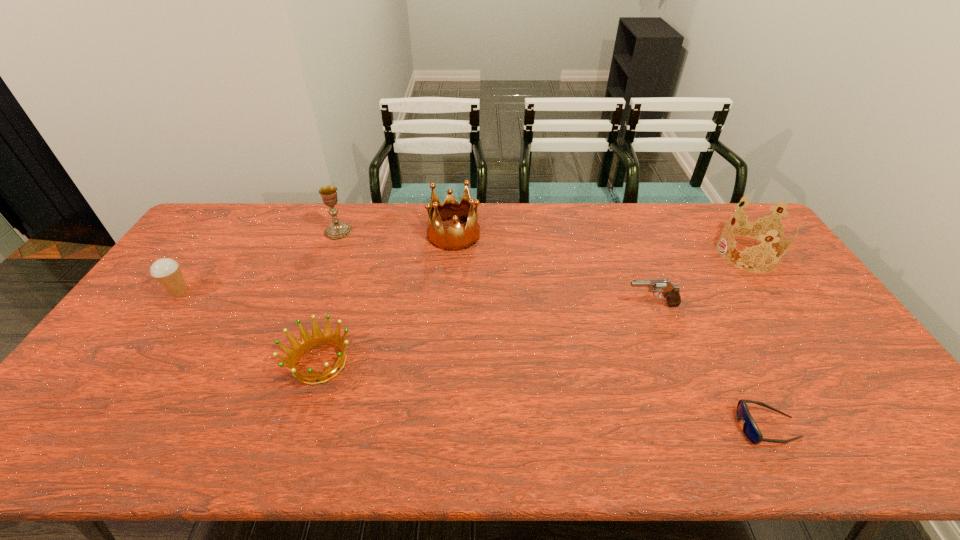
Identify the location of the fourth object from right to left. The image size is (960, 540). (455, 238).

You are a GUI agent. You are given a task and a screenshot of the screen. Output one action in this format:
    pyautogui.click(x=<x>, y=<y>)
    Task: Click on the chalice
    This screenshot has height=540, width=960.
    Given the screenshot: What is the action you would take?
    pyautogui.click(x=336, y=230)

The image size is (960, 540). I want to click on the rightmost object, so click(760, 229).

Image resolution: width=960 pixels, height=540 pixels. In order to click on icecream in this screenshot , I will do `click(166, 271)`.

The image size is (960, 540). Find the location of `the fourth farthest object`. the fourth farthest object is located at coordinates 166,271.

What are the coordinates of `pistol` in the screenshot? It's located at (671, 292).

You are a GUI agent. You are given a task and a screenshot of the screen. Output one action in this format:
    pyautogui.click(x=<x>, y=<y>)
    Task: Click on the third object from right to left
    
    Given the screenshot: What is the action you would take?
    pyautogui.click(x=671, y=292)

Where is `the shortest crown`? the shortest crown is located at coordinates (307, 342).

Identify the location of the leftmost crown. Image resolution: width=960 pixels, height=540 pixels. (307, 342).

Identify the location of the nearest object. (750, 429).